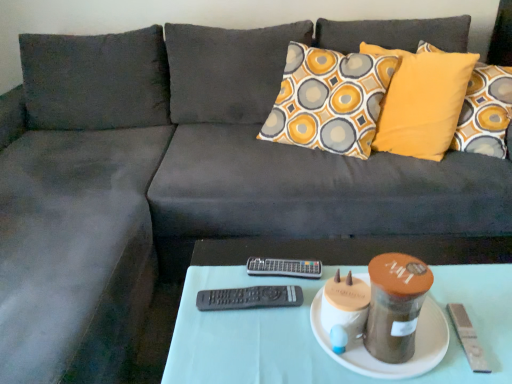
This screenshot has width=512, height=384. Identify the location of free space on the front side of black plastic remote at center, marked as the 2th remote in a top-to-bottom arrangement. (246, 347).